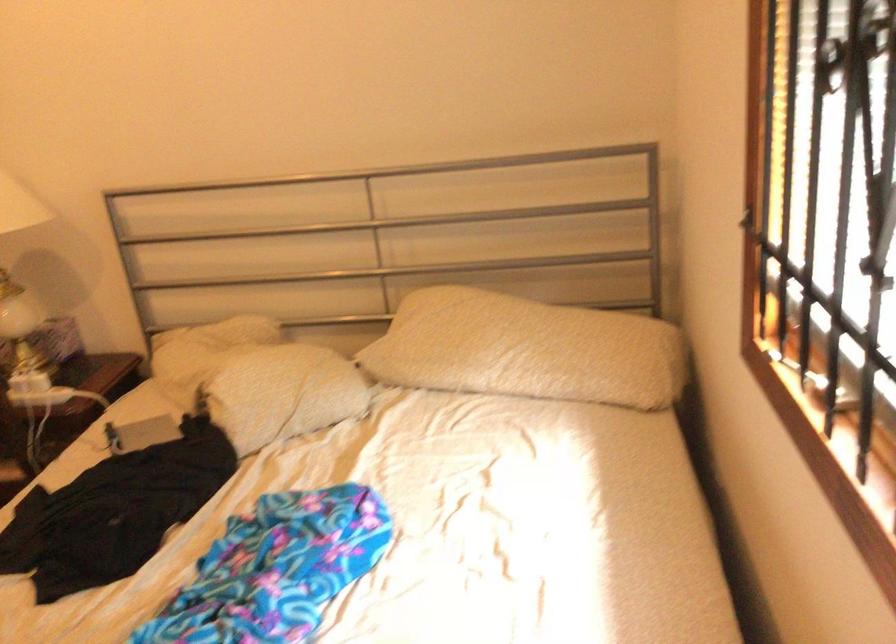
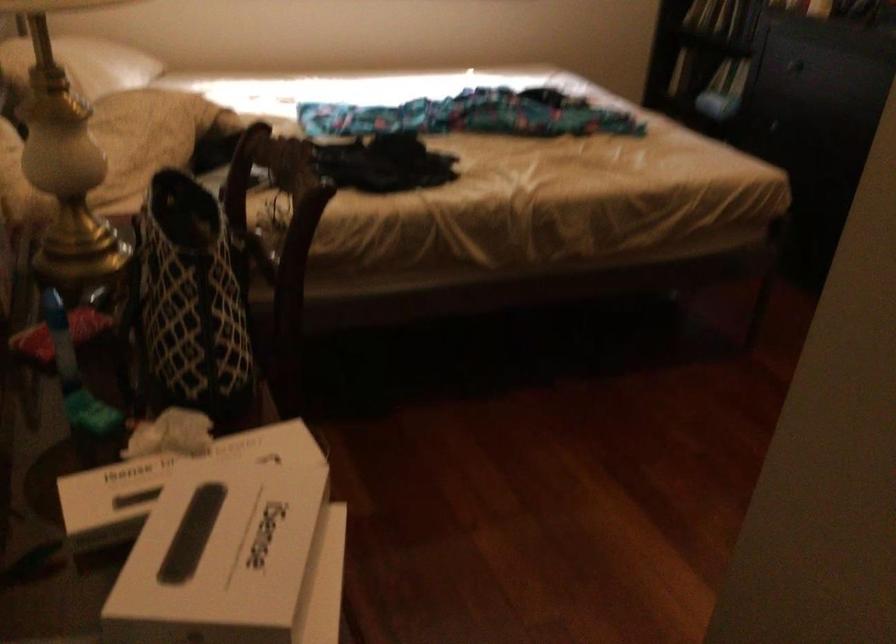
In the second image, find the point that corresponds to (x=424, y=332) in the first image.

(82, 64)